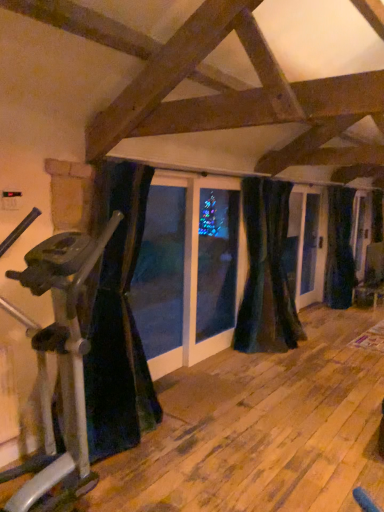
Question: From a real-world perspective, is velvet dark blue curtain at center, which is the 2th curtain from back to front, above or below silver metallic stationary bicycle at left?

Choices:
 (A) below
 (B) above

Answer: (B)

Question: Considering the positions of velvet dark blue curtain at center, which is the 2th curtain from back to front, and silver metallic stationary bicycle at left in the image, is velvet dark blue curtain at center, which is the 2th curtain from back to front, wider or thinner than silver metallic stationary bicycle at left?

Choices:
 (A) thin
 (B) wide

Answer: (A)

Question: Based on their relative distances, which object is farther from the velvet dark blue curtain at center, marked as the 2th curtain in a front-to-back arrangement?

Choices:
 (A) silver metallic stationary bicycle at left
 (B) dark blue velvet curtain at right, the first curtain viewed from the right
 (C) black velvet curtain at left, arranged as the first curtain when viewed from the front

Answer: (A)

Question: Considering the real-world distances, which object is closest to the silver metallic stationary bicycle at left?

Choices:
 (A) black velvet curtain at left, arranged as the first curtain when viewed from the front
 (B) velvet dark blue curtain at center, which appears as the 2th curtain when viewed from the left
 (C) dark blue velvet curtain at right, the first curtain viewed from the right

Answer: (A)